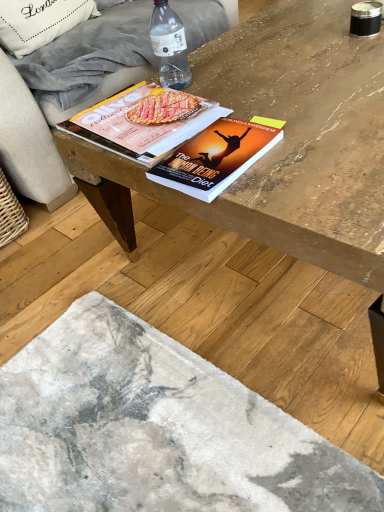
Question: Is white fabric pillow at upper left surrounding matte paper magazine at center, marked as the first book in a back-to-front arrangement?

Choices:
 (A) no
 (B) yes

Answer: (A)

Question: Is white fabric pillow at upper left thinner than matte paper magazine at center, which is the 2th book from front to back?

Choices:
 (A) no
 (B) yes

Answer: (B)

Question: Is white fabric pillow at upper left located outside matte paper magazine at center, which is the 2th book from front to back?

Choices:
 (A) yes
 (B) no

Answer: (A)

Question: From the image's perspective, is white fabric pillow at upper left over matte paper magazine at center, which is the 2th book from front to back?

Choices:
 (A) yes
 (B) no

Answer: (A)

Question: Is white fabric pillow at upper left aimed at matte paper magazine at center, which is the 2th book from front to back?

Choices:
 (A) no
 (B) yes

Answer: (B)

Question: Visually, is wooden coffee table at center positioned to the left or to the right of wooden table at center?

Choices:
 (A) right
 (B) left

Answer: (A)

Question: Is point (332, 228) positioned closer to the camera than point (165, 402)?

Choices:
 (A) farther
 (B) closer

Answer: (B)

Question: From a real-world perspective, is wooden coffee table at center above or below wooden table at center?

Choices:
 (A) below
 (B) above

Answer: (B)

Question: Which is correct: wooden coffee table at center is inside wooden table at center, or outside of it?

Choices:
 (A) outside
 (B) inside

Answer: (A)

Question: In the image, is white fabric pillow at upper left positioned in front of or behind hardcover book at center, acting as the second book starting from the back?

Choices:
 (A) behind
 (B) front

Answer: (A)

Question: From the image's perspective, relative to hardcover book at center, acting as the second book starting from the back, is white fabric pillow at upper left above or below?

Choices:
 (A) above
 (B) below

Answer: (A)

Question: Do you think white fabric pillow at upper left is within hardcover book at center, acting as the second book starting from the back, or outside of it?

Choices:
 (A) inside
 (B) outside

Answer: (B)

Question: Is white fabric pillow at upper left bigger or smaller than hardcover book at center, acting as the second book starting from the back?

Choices:
 (A) small
 (B) big

Answer: (B)

Question: In terms of height, does wooden table at center look taller or shorter compared to wooden coffee table at center?

Choices:
 (A) tall
 (B) short

Answer: (B)

Question: Considering the positions of point (140, 379) and point (304, 18), is point (140, 379) closer or farther from the camera than point (304, 18)?

Choices:
 (A) farther
 (B) closer

Answer: (B)